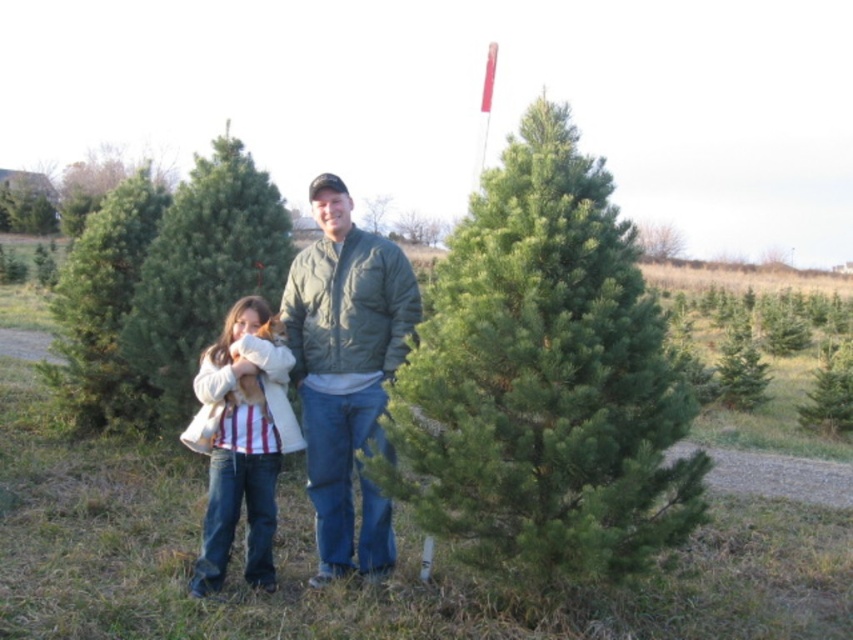
You are a photographer trying to capture a clear photo of the green matte christmas tree at center. However, the green matte jacket at center is blocking your view. Can you move the jacket to the side so that the tree is visible?

The green matte jacket at center is in front of the green matte christmas tree at center, so moving the jacket to the side would allow the tree to be visible.